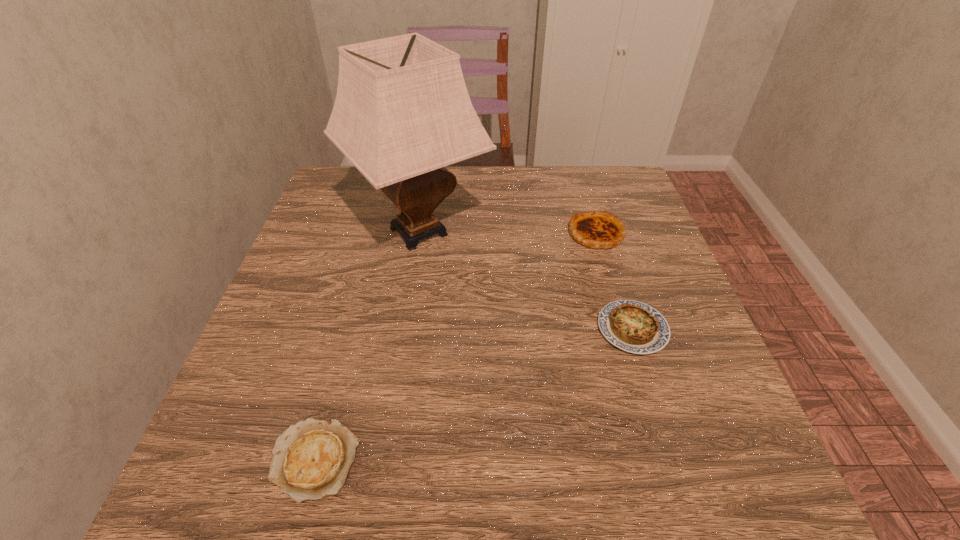
Where is `the tallest object`? Image resolution: width=960 pixels, height=540 pixels. the tallest object is located at coordinates (402, 113).

Where is `the tallest quiche`? The width and height of the screenshot is (960, 540). the tallest quiche is located at coordinates (596, 229).

This screenshot has width=960, height=540. In order to click on the second tallest object in this screenshot , I will do `click(596, 229)`.

Find the location of a particular element. The width and height of the screenshot is (960, 540). the second nearest quiche is located at coordinates (633, 326).

Where is `the second shortest quiche`? This screenshot has width=960, height=540. the second shortest quiche is located at coordinates (633, 326).

Where is `the nearest quiche`? The height and width of the screenshot is (540, 960). the nearest quiche is located at coordinates (311, 460).

Locate an element on the screen. the nearest object is located at coordinates (311, 460).

Where is `vacant region located on the back of the lampshade`? vacant region located on the back of the lampshade is located at coordinates (428, 170).

I want to click on vacant space located on the front of the farthest quiche, so click(x=621, y=316).

At what (x,y) coordinates should I click in order to perform the action: click on vacant space situated on the back of the second nearest quiche. Please return your answer as a coordinate pair (x, y). This screenshot has width=960, height=540. Looking at the image, I should click on (596, 214).